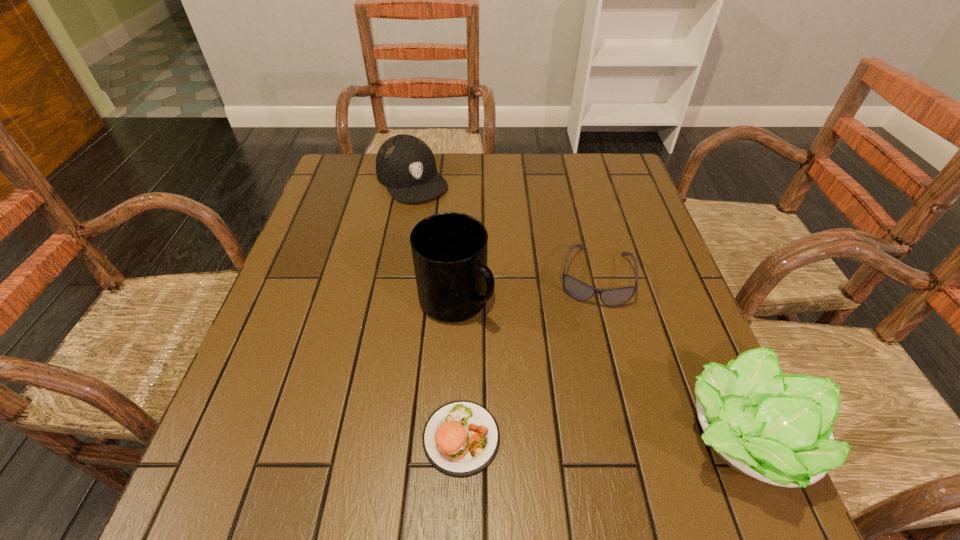
Image resolution: width=960 pixels, height=540 pixels. Find the location of `vacant space on the desktop that is between the shortest object and the lettuce and is positioned on the side of the mug with the handle`. vacant space on the desktop that is between the shortest object and the lettuce and is positioned on the side of the mug with the handle is located at coordinates (613, 438).

Image resolution: width=960 pixels, height=540 pixels. What are the coordinates of `free spot on the desktop that is between the patty and the lettuce and is positioned on the lenses of the sunglasses` in the screenshot? It's located at (578, 438).

Image resolution: width=960 pixels, height=540 pixels. Identify the location of vacant spot on the desktop that is between the patty and the lettuce and is positioned on the front-facing side of the farthest object. (601, 438).